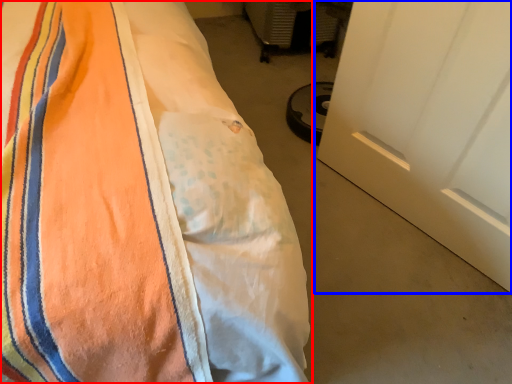
Question: Which object appears closest to the camera in this image, bed (highlighted by a red box) or door (highlighted by a blue box)?

Choices:
 (A) bed
 (B) door

Answer: (A)